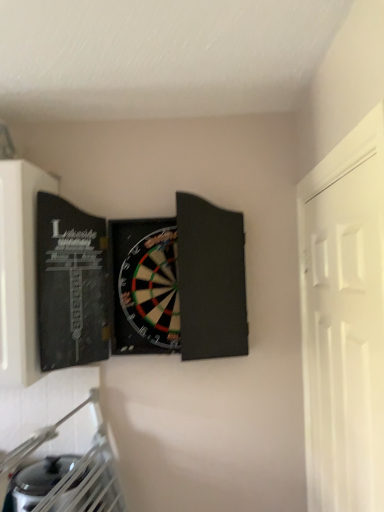
Question: Is black matte dartboard at center shorter than white matte door at right?

Choices:
 (A) no
 (B) yes

Answer: (B)

Question: Considering the relative sizes of black matte dartboard at center and white matte door at right in the image provided, is black matte dartboard at center wider than white matte door at right?

Choices:
 (A) no
 (B) yes

Answer: (B)

Question: From a real-world perspective, is black matte dartboard at center physically below white matte door at right?

Choices:
 (A) yes
 (B) no

Answer: (B)

Question: Can you confirm if black matte dartboard at center is smaller than white matte door at right?

Choices:
 (A) yes
 (B) no

Answer: (B)

Question: Would you consider black matte dartboard at center to be distant from white matte door at right?

Choices:
 (A) yes
 (B) no

Answer: (B)

Question: Is black matte dartboard at center at the right side of white matte door at right?

Choices:
 (A) yes
 (B) no

Answer: (B)

Question: Considering the relative sizes of white matte door at right and black matte dartboard at center in the image provided, is white matte door at right bigger than black matte dartboard at center?

Choices:
 (A) yes
 (B) no

Answer: (B)

Question: Is the depth of white matte door at right greater than that of black matte dartboard at center?

Choices:
 (A) no
 (B) yes

Answer: (A)

Question: Is white matte door at right smaller than black matte dartboard at center?

Choices:
 (A) no
 (B) yes

Answer: (B)

Question: Is white matte door at right not within black matte dartboard at center?

Choices:
 (A) no
 (B) yes

Answer: (B)

Question: Is white matte door at right thinner than black matte dartboard at center?

Choices:
 (A) no
 (B) yes

Answer: (B)

Question: Does white matte door at right turn towards black matte dartboard at center?

Choices:
 (A) yes
 (B) no

Answer: (A)

Question: Does point (61, 306) appear closer or farther from the camera than point (332, 297)?

Choices:
 (A) closer
 (B) farther

Answer: (B)